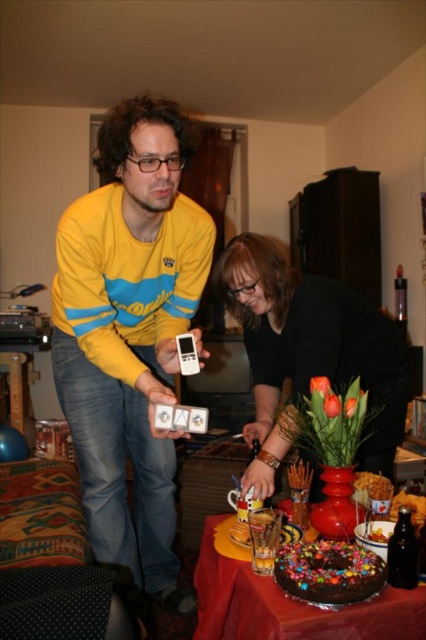
Is yellow long-sleeve shirt at left positioned in front of chocolate frosted cake at lower center?

No, yellow long-sleeve shirt at left is behind chocolate frosted cake at lower center.

Who is lower down, yellow long-sleeve shirt at left or chocolate frosted cake at lower center?

Positioned lower is chocolate frosted cake at lower center.

Does point (123, 252) lie behind point (296, 547)?

Yes.

Find the location of a particular element. The width and height of the screenshot is (426, 640). yellow long-sleeve shirt at left is located at coordinates (129, 332).

Can you confirm if yellow long-sleeve shirt at upper left is taller than black matte vase at center?

Indeed, yellow long-sleeve shirt at upper left has a greater height compared to black matte vase at center.

Does yellow long-sleeve shirt at upper left appear under black matte vase at center?

Yes.

Describe the element at coordinates (129, 326) in the screenshot. I see `yellow long-sleeve shirt at upper left` at that location.

Where is `yellow long-sleeve shirt at upper left`? yellow long-sleeve shirt at upper left is located at coordinates (129, 326).

Can you confirm if yellow long-sleeve shirt at upper left is shorter than chocolate frosted cake at lower center?

No, yellow long-sleeve shirt at upper left is not shorter than chocolate frosted cake at lower center.

Is point (193, 310) farther from camera compared to point (284, 554)?

Yes, point (193, 310) is behind point (284, 554).

Locate an element on the screen. yellow long-sleeve shirt at upper left is located at coordinates (129, 326).